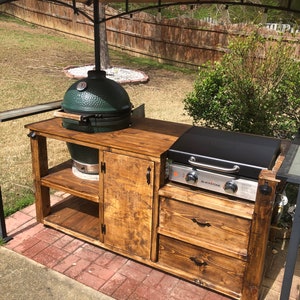
This screenshot has height=300, width=300. What are the coordinates of `metal rail` in the screenshot? It's located at (35, 107).